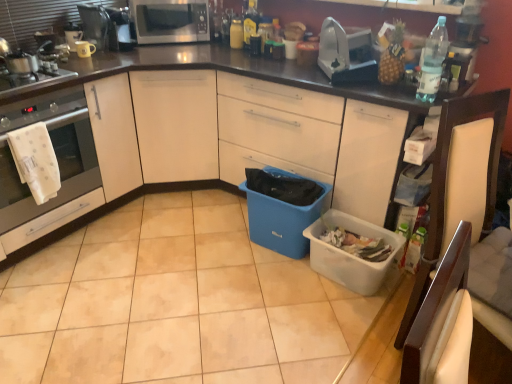
Locate an element on the screen. The height and width of the screenshot is (384, 512). free space to the left of white leather chair at right is located at coordinates (332, 333).